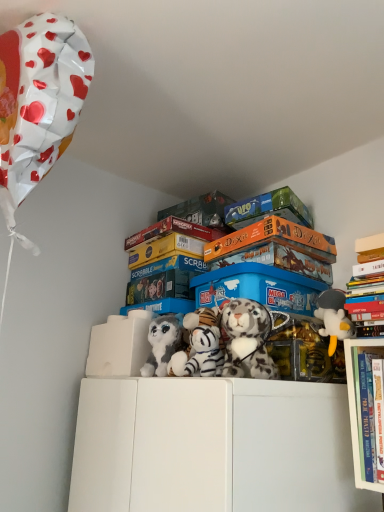
Question: Considering the relative sizes of blue plastic storage box at center and hardcover books at upper right in the image provided, is blue plastic storage box at center taller than hardcover books at upper right?

Choices:
 (A) yes
 (B) no

Answer: (B)

Question: Can you confirm if blue plastic storage box at center is positioned to the left of hardcover books at upper right?

Choices:
 (A) yes
 (B) no

Answer: (A)

Question: From the image's perspective, is blue plastic storage box at center located beneath hardcover books at upper right?

Choices:
 (A) no
 (B) yes

Answer: (A)

Question: From the image's perspective, is blue plastic storage box at center over hardcover books at upper right?

Choices:
 (A) yes
 (B) no

Answer: (A)

Question: Can you confirm if blue plastic storage box at center is smaller than hardcover books at upper right?

Choices:
 (A) yes
 (B) no

Answer: (B)

Question: Is white plush tiger at center, the third toy in the right-to-left sequence, wider or thinner than white plush tiger at center, the second toy positioned from the right?

Choices:
 (A) thin
 (B) wide

Answer: (A)

Question: Would you say white plush tiger at center, the second toy viewed from the left, is to the left or to the right of white plush tiger at center, the second toy positioned from the right, in the picture?

Choices:
 (A) left
 (B) right

Answer: (A)

Question: Considering the positions of point (185, 354) and point (228, 328), is point (185, 354) closer or farther from the camera than point (228, 328)?

Choices:
 (A) closer
 (B) farther

Answer: (B)

Question: From a real-world perspective, relative to white plush tiger at center, the second toy positioned from the right, is white plush tiger at center, the second toy viewed from the left, vertically above or below?

Choices:
 (A) below
 (B) above

Answer: (A)

Question: Considering their positions, is blue plastic storage box at center located in front of or behind white plush tiger at center, arranged as the 3th toy when viewed from the left?

Choices:
 (A) behind
 (B) front

Answer: (A)

Question: Visually, is blue plastic storage box at center positioned to the left or to the right of white plush tiger at center, arranged as the 3th toy when viewed from the left?

Choices:
 (A) right
 (B) left

Answer: (A)

Question: Considering the positions of blue plastic storage box at center and white plush tiger at center, the second toy positioned from the right, in the image, is blue plastic storage box at center bigger or smaller than white plush tiger at center, the second toy positioned from the right,?

Choices:
 (A) small
 (B) big

Answer: (B)

Question: Looking at their shapes, would you say blue plastic storage box at center is wider or thinner than white plush tiger at center, arranged as the 3th toy when viewed from the left?

Choices:
 (A) thin
 (B) wide

Answer: (B)

Question: Considering the positions of fluffy gray plush at center, which is counted as the 1th toy, starting from the left, and white plush tiger at center, the third toy in the right-to-left sequence, in the image, is fluffy gray plush at center, which is counted as the 1th toy, starting from the left, bigger or smaller than white plush tiger at center, the third toy in the right-to-left sequence,?

Choices:
 (A) big
 (B) small

Answer: (A)

Question: Is fluffy gray plush at center, the fourth toy when ordered from right to left, inside or outside of white plush tiger at center, the second toy viewed from the left?

Choices:
 (A) outside
 (B) inside

Answer: (A)